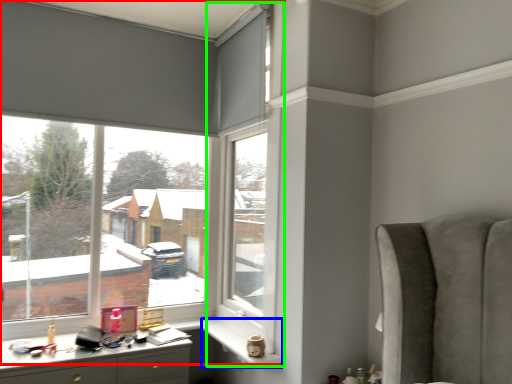
Question: Estimate the real-world distances between objects in this image. Which object is closer to window (highlighted by a red box), window sill (highlighted by a blue box) or window frame (highlighted by a green box)?

Choices:
 (A) window sill
 (B) window frame

Answer: (B)